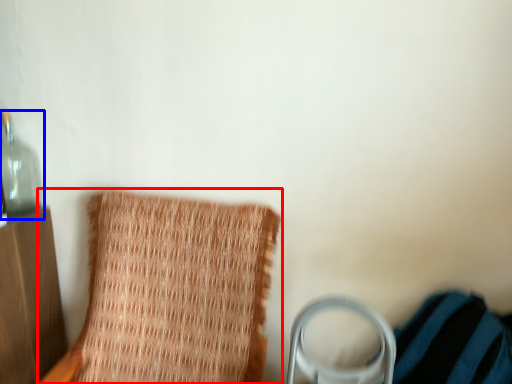
Question: Which of the following is the closest to the observer, furniture (highlighted by a red box) or bottle (highlighted by a blue box)?

Choices:
 (A) furniture
 (B) bottle

Answer: (A)